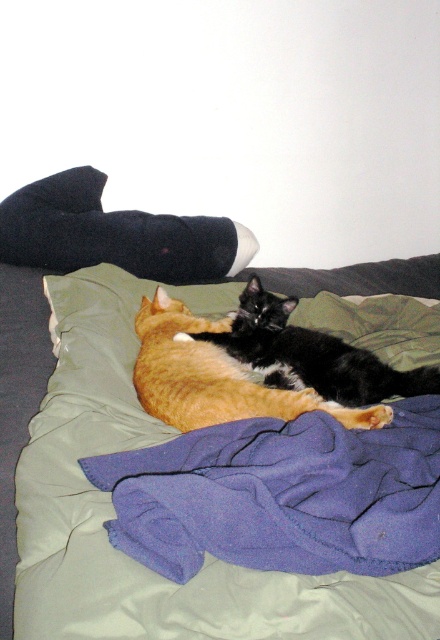
Question: Which object is farther from the camera taking this photo?

Choices:
 (A) soft green blanket at center
 (B) purple fleece blanket at center
 (C) black fur cat at center

Answer: (C)

Question: Does soft green blanket at center have a lesser width compared to purple fleece blanket at center?

Choices:
 (A) no
 (B) yes

Answer: (A)

Question: Does soft green blanket at center appear on the left side of black fur cat at center?

Choices:
 (A) no
 (B) yes

Answer: (B)

Question: Which point appears farthest from the camera in this image?

Choices:
 (A) (278, 579)
 (B) (286, 513)
 (C) (377, 365)

Answer: (C)

Question: Is the position of soft green blanket at center more distant than that of black fur cat at center?

Choices:
 (A) yes
 (B) no

Answer: (B)

Question: Among these objects, which one is farthest from the camera?

Choices:
 (A) purple fleece blanket at center
 (B) black fur cat at center

Answer: (B)